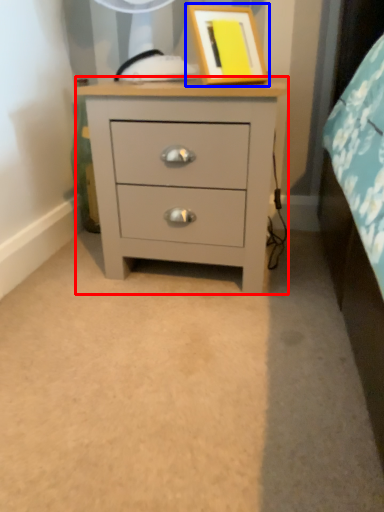
Question: Which object appears farthest to the camera in this image, chest of drawers (highlighted by a red box) or picture frame (highlighted by a blue box)?

Choices:
 (A) chest of drawers
 (B) picture frame

Answer: (A)